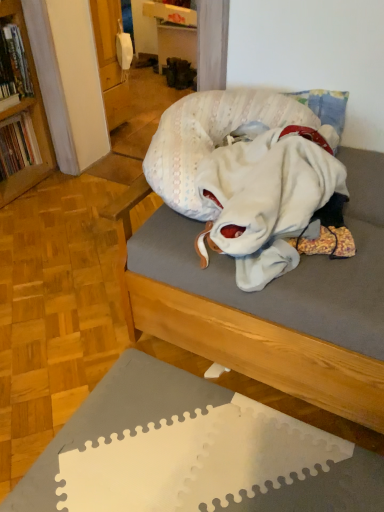
Question: From the image's perspective, is white cotton blanket at center on top of wooden studio couch at center?

Choices:
 (A) yes
 (B) no

Answer: (A)

Question: Is white cotton blanket at center shorter than wooden studio couch at center?

Choices:
 (A) no
 (B) yes

Answer: (B)

Question: Does white cotton blanket at center have a lesser width compared to wooden studio couch at center?

Choices:
 (A) yes
 (B) no

Answer: (A)

Question: Is white cotton blanket at center aimed at wooden studio couch at center?

Choices:
 (A) yes
 (B) no

Answer: (B)

Question: Is white cotton blanket at center wider than wooden studio couch at center?

Choices:
 (A) no
 (B) yes

Answer: (A)

Question: Is white cotton blanket at center inside or outside of hardcover book at left, the 1th book from the bottom?

Choices:
 (A) inside
 (B) outside

Answer: (B)

Question: Is white cotton blanket at center taller or shorter than hardcover book at left, marked as the 2th book in a top-to-bottom arrangement?

Choices:
 (A) short
 (B) tall

Answer: (A)

Question: Based on their positions, is white cotton blanket at center located to the left or right of hardcover book at left, marked as the 2th book in a top-to-bottom arrangement?

Choices:
 (A) left
 (B) right

Answer: (B)

Question: Is white cotton blanket at center bigger or smaller than hardcover book at left, the 1th book from the bottom?

Choices:
 (A) small
 (B) big

Answer: (B)

Question: Is wooden studio couch at center inside or outside of hardcover book at left, the 1th book from the bottom?

Choices:
 (A) outside
 (B) inside

Answer: (A)

Question: From the image's perspective, is wooden studio couch at center positioned above or below hardcover book at left, the 1th book from the bottom?

Choices:
 (A) below
 (B) above

Answer: (A)

Question: Is wooden studio couch at center in front of or behind hardcover book at left, marked as the 2th book in a top-to-bottom arrangement, in the image?

Choices:
 (A) behind
 (B) front

Answer: (B)

Question: Is wooden studio couch at center taller or shorter than hardcover book at left, the 1th book from the bottom?

Choices:
 (A) short
 (B) tall

Answer: (B)

Question: In the image, is white cotton blanket at center positioned in front of or behind wooden studio couch at center?

Choices:
 (A) front
 (B) behind

Answer: (B)

Question: From a real-world perspective, is white cotton blanket at center above or below wooden studio couch at center?

Choices:
 (A) above
 (B) below

Answer: (A)